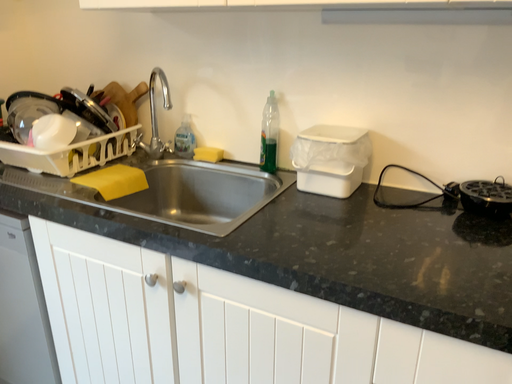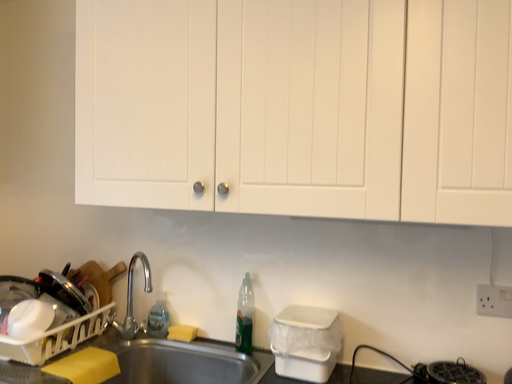
Question: Which way did the camera rotate in the video?

Choices:
 (A) rotated right
 (B) rotated left

Answer: (A)